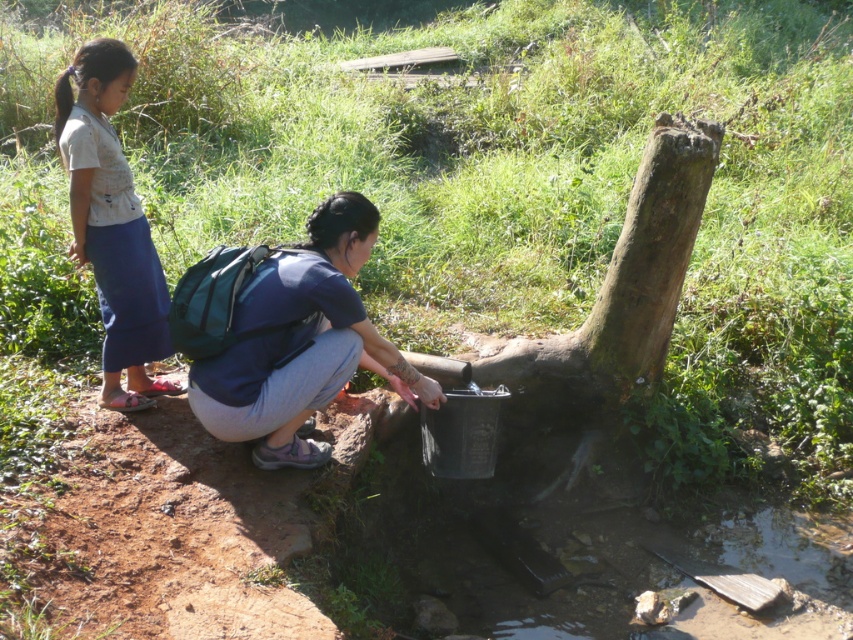
Question: Which of the following is the farthest from the observer?

Choices:
 (A) green mossy tree trunk at center
 (B) light blue denim skirt at left
 (C) blue fabric backpack at center

Answer: (A)

Question: In this image, where is blue fabric backpack at center located relative to green mossy tree trunk at center?

Choices:
 (A) left
 (B) right

Answer: (A)

Question: Can you confirm if blue fabric backpack at center is positioned to the left of light blue denim skirt at left?

Choices:
 (A) no
 (B) yes

Answer: (A)

Question: In this image, where is blue fabric backpack at center located relative to light blue denim skirt at left?

Choices:
 (A) left
 (B) right

Answer: (B)

Question: Which object is closer to the camera taking this photo?

Choices:
 (A) light blue denim skirt at left
 (B) green mossy tree trunk at center
 (C) blue fabric backpack at center

Answer: (C)

Question: Which object is the farthest from the green mossy tree trunk at center?

Choices:
 (A) blue fabric backpack at center
 (B) light blue denim skirt at left

Answer: (B)